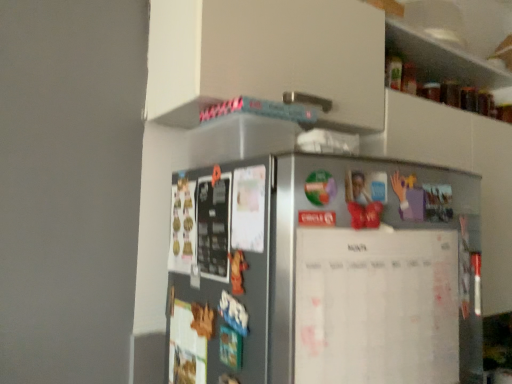
Image resolution: width=512 pixels, height=384 pixels. Describe the element at coordinates (219, 274) in the screenshot. I see `satin silver fridge at left` at that location.

I want to click on satin silver fridge at left, so click(x=219, y=274).

Image resolution: width=512 pixels, height=384 pixels. Describe the element at coordinates (376, 306) in the screenshot. I see `white paperboard at center` at that location.

You are a GUI agent. You are given a task and a screenshot of the screen. Output one action in this format:
    pyautogui.click(x=<x>, y=<y>)
    Task: Click on the white paperboard at center
    The width and height of the screenshot is (512, 384).
    Given the screenshot: What is the action you would take?
    pyautogui.click(x=376, y=306)

Identify the location of satin silver fridge at left. This screenshot has height=384, width=512. (219, 274).

Can you confirm if satin silver fridge at left is positioned to the left of white paperboard at center?

Correct, you'll find satin silver fridge at left to the left of white paperboard at center.

Is the position of satin silver fridge at left less distant than that of white paperboard at center?

Yes, it is.

Which point is more forward, (179, 208) or (332, 277)?

The point (332, 277) is more forward.

From the image's perspective, is satin silver fridge at left positioned above or below white paperboard at center?

satin silver fridge at left is above white paperboard at center.

From a real-world perspective, which is physically below, satin silver fridge at left or white paperboard at center?

From a 3D spatial view, white paperboard at center is below.

Does satin silver fridge at left have a lesser width compared to white paperboard at center?

Incorrect, the width of satin silver fridge at left is not less than that of white paperboard at center.

Can you confirm if satin silver fridge at left is shorter than white paperboard at center?

No, satin silver fridge at left is not shorter than white paperboard at center.

Can you confirm if satin silver fridge at left is smaller than white paperboard at center?

Incorrect, satin silver fridge at left is not smaller in size than white paperboard at center.

Is satin silver fridge at left located outside white paperboard at center?

Indeed, satin silver fridge at left is completely outside white paperboard at center.

Is satin silver fridge at left far away from white paperboard at center?

No, there isn't a large distance between satin silver fridge at left and white paperboard at center.

Does satin silver fridge at left turn towards white paperboard at center?

No.

The image size is (512, 384). Identify the location of bulletin board on the right side of satin silver fridge at left. (376, 306).

Considering the relative positions of white paperboard at center and satin silver fridge at left in the image provided, is white paperboard at center to the left of satin silver fridge at left from the viewer's perspective?

Incorrect, white paperboard at center is not on the left side of satin silver fridge at left.

Which is behind, white paperboard at center or satin silver fridge at left?

white paperboard at center is further away from the camera.

Which is in front, point (340, 256) or point (186, 177)?

The point (340, 256) is in front.

From the image's perspective, is white paperboard at center below satin silver fridge at left?

Indeed, from the image's perspective, white paperboard at center is shown beneath satin silver fridge at left.

Looking at this image, from a real-world perspective, is white paperboard at center physically above satin silver fridge at left?

No.

Considering the relative sizes of white paperboard at center and satin silver fridge at left in the image provided, is white paperboard at center thinner than satin silver fridge at left?

Yes, white paperboard at center is thinner than satin silver fridge at left.

From their relative heights in the image, would you say white paperboard at center is taller or shorter than satin silver fridge at left?

Clearly, white paperboard at center is shorter compared to satin silver fridge at left.

Who is bigger, white paperboard at center or satin silver fridge at left?

Bigger between the two is satin silver fridge at left.

Is white paperboard at center completely or partially outside of satin silver fridge at left?

Yes.

In the scene shown: Is the surface of white paperboard at center in direct contact with satin silver fridge at left?

No, white paperboard at center is not next to satin silver fridge at left.

Looking at this image, is white paperboard at center turned away from satin silver fridge at left?

Yes, satin silver fridge at left is at the back of white paperboard at center.

Can you tell me how much white paperboard at center and satin silver fridge at left differ in facing direction?

There is a 85-degree angle between the facing directions of white paperboard at center and satin silver fridge at left.

I want to click on bulletin board below the satin silver fridge at left (from a real-world perspective), so click(376, 306).

The height and width of the screenshot is (384, 512). I want to click on bulletin board on the right of satin silver fridge at left, so 376,306.

You are a GUI agent. You are given a task and a screenshot of the screen. Output one action in this format:
    pyautogui.click(x=<x>, y=<y>)
    Task: Click on the fridge on the left of white paperboard at center
    
    Given the screenshot: What is the action you would take?
    pyautogui.click(x=219, y=274)